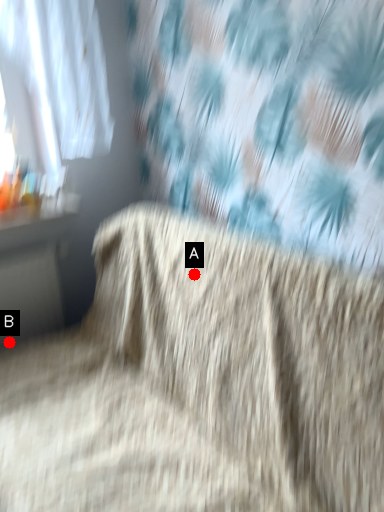
Question: Two points are circled on the image, labeled by A and B beside each circle. Among these points, which one is farthest from the camera?

Choices:
 (A) A is further
 (B) B is further

Answer: (B)